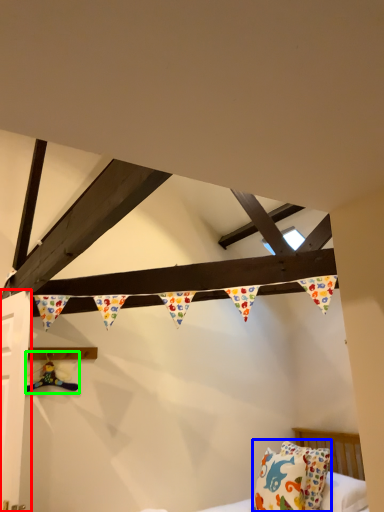
Question: Which object is the farthest from door (highlighted by a red box)? Choose among these: pillow (highlighted by a blue box) or toy (highlighted by a green box).

Choices:
 (A) pillow
 (B) toy

Answer: (A)